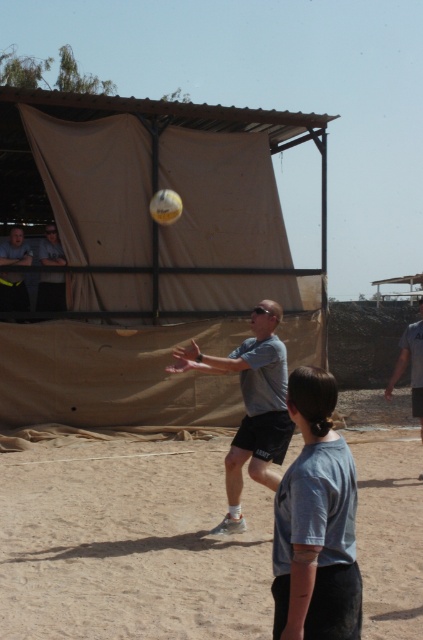
You are a photographer trying to capture a photo of the volleyball game. You notice the brown sandy dirt at center and the gray fabric shirt at center. Which object is positioned to the left of the other?

The brown sandy dirt at center is to the left of the gray fabric shirt at center.

You are a photographer trying to capture the volleyball game. You need to position yourself so that both the brown sandy dirt at center and the light blue shirt at lower center are visible in your shot. Which object should you ensure is closer to the camera to include both in the frame?

To include both the brown sandy dirt at center and the light blue shirt at lower center in the frame, you should position yourself so that the light blue shirt at lower center is closer to the camera since the brown sandy dirt at center might be wider than the light blue shirt at lower center.

You are standing at the volleyball court and want to throw a ball to the point marked at coordinates point (161, 580). Considering your throwing distance is 20 feet, will you be able to reach that point?

The distance between you and the point (161, 580) is 22.06 feet, which is beyond your throwing range of 20 feet. Therefore, you won not be able to reach that point.